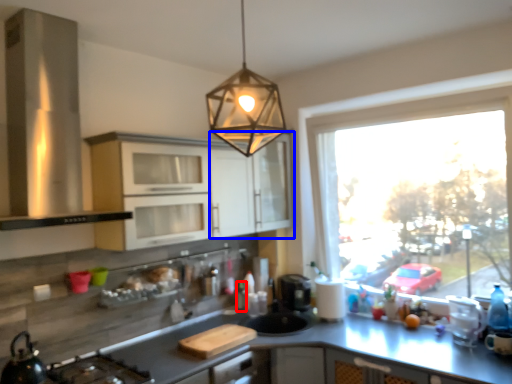
Question: Which point is closer to the camera, bottle (highlighted by a red box) or cabinetry (highlighted by a blue box)?

Choices:
 (A) bottle
 (B) cabinetry

Answer: (B)